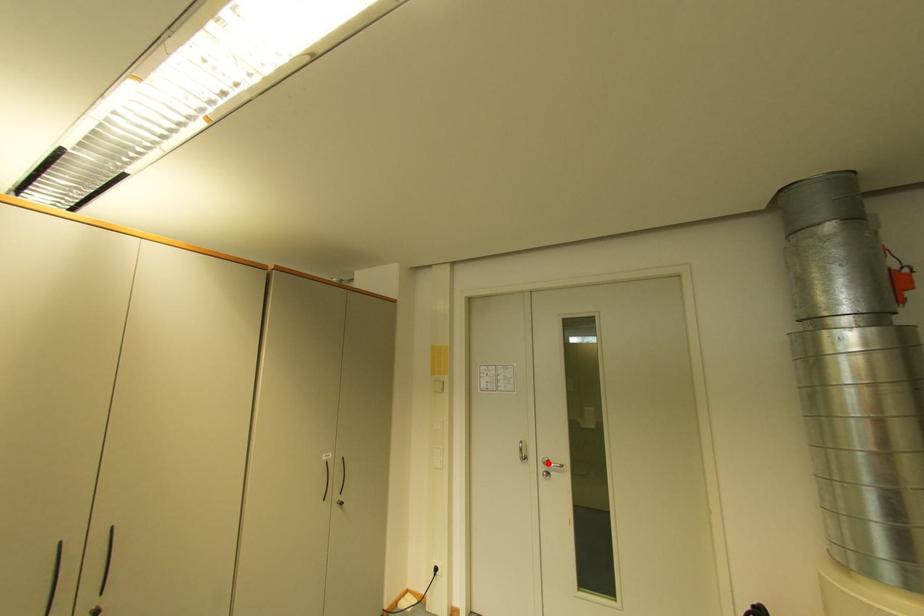
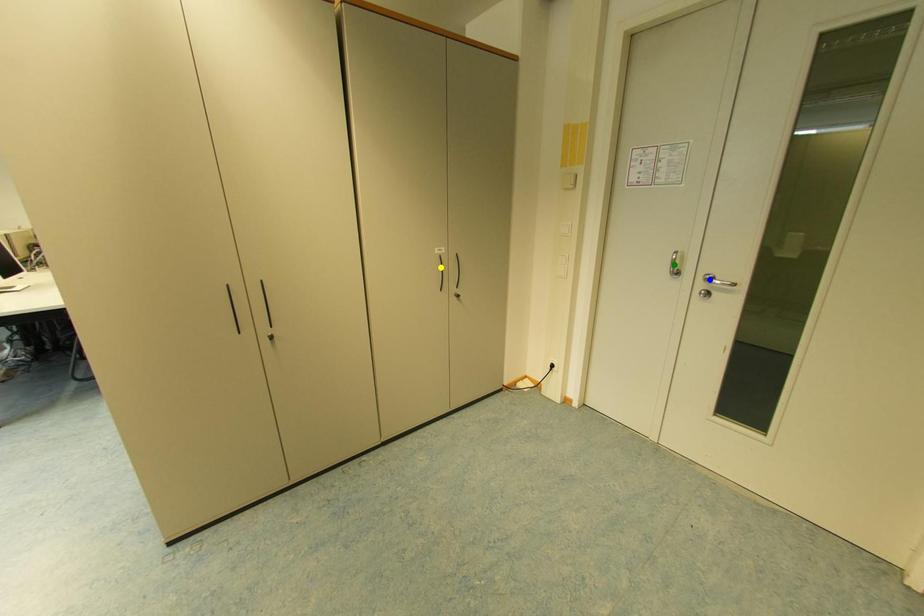
Question: I am providing you with two images of the same scene from different viewpoints. A red point is marked on the first image. You are given multiple points on the second image. Which mark in image 2 goes with the point in image 1?

Choices:
 (A) green point
 (B) blue point
 (C) yellow point

Answer: (B)